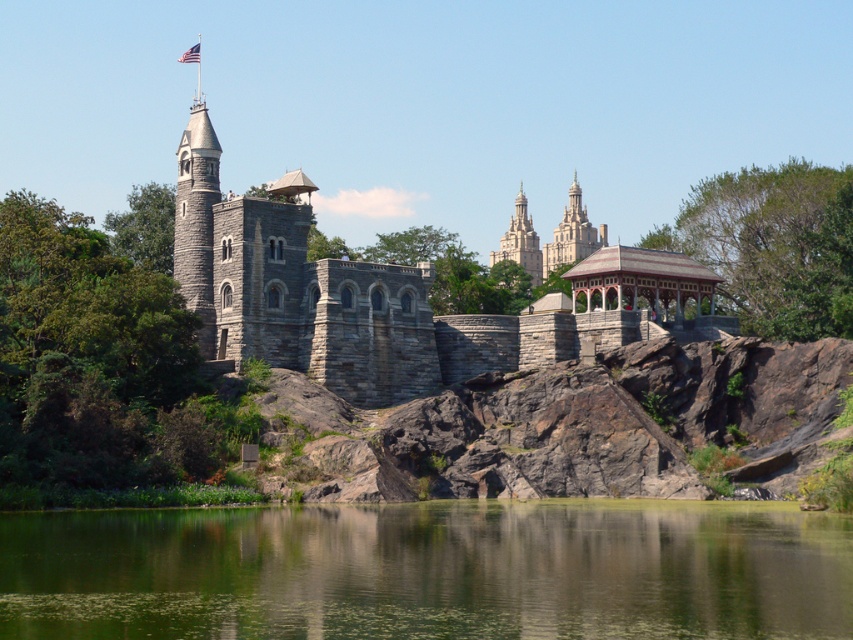
Can you confirm if wooden gazebo at center is shorter than american flag at upper center?

No, wooden gazebo at center is not shorter than american flag at upper center.

Is point (610, 285) positioned behind point (183, 58)?

No, it is in front of (183, 58).

You are a GUI agent. You are given a task and a screenshot of the screen. Output one action in this format:
    pyautogui.click(x=<x>, y=<y>)
    Task: Click on the wooden gazebo at center
    The image size is (853, 640).
    Given the screenshot: What is the action you would take?
    pyautogui.click(x=641, y=280)

Does green reflective water at center appear on the left side of wooden gazebo at center?

Indeed, green reflective water at center is positioned on the left side of wooden gazebo at center.

Identify the location of green reflective water at center. (430, 572).

The image size is (853, 640). Identify the location of green reflective water at center. (430, 572).

Which is below, wooden gazebo at center or light gray stone tower at center?

wooden gazebo at center is lower down.

Can you confirm if wooden gazebo at center is positioned below light gray stone tower at center?

Yes, wooden gazebo at center is below light gray stone tower at center.

Does point (624, 292) come behind point (527, 232)?

No.

The image size is (853, 640). Identify the location of wooden gazebo at center. (641, 280).